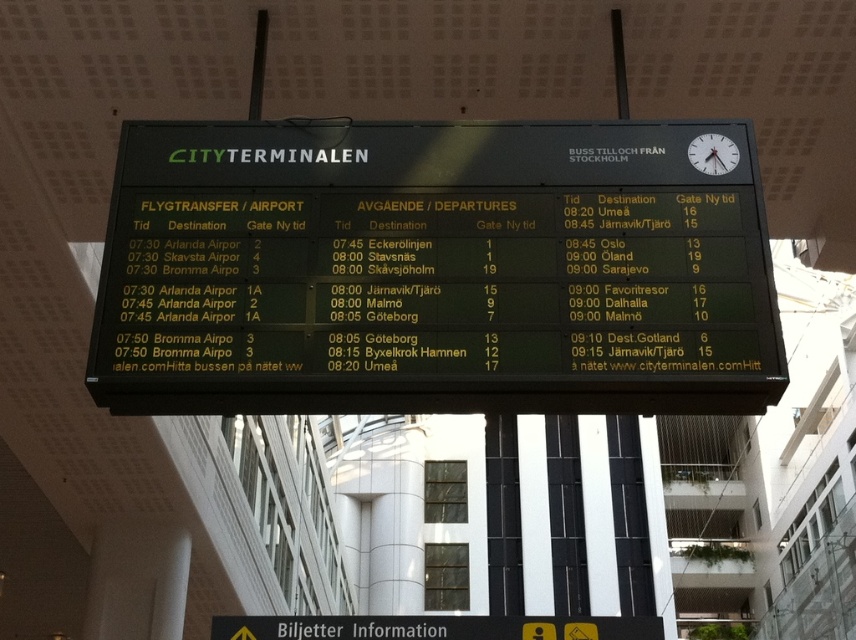
You are a traveler at Cityterminalen and need to check both the green plastic scoreboard at center and the white glossy clock at upper right. Which object is wider?

The green plastic scoreboard at center is wider than the white glossy clock at upper right.

You are a traveler at Cityterminalen looking at the digital departure board. You see two points marked on the board at coordinates point [330,154] and point [702,168]. Which point is closer to the front of the board?

Point [330,154] is behind point [702,168], so the point closer to the front of the board is point [702,168].

You are a maintenance worker needing to reach both the green plastic scoreboard at center and the white glossy clock at upper right with a 1.8 meter ladder. Can you safely access both objects with the ladder?

The distance between the green plastic scoreboard at center and the white glossy clock at upper right is 1.79 meters. Since the ladder is 1.8 meters long, it is just long enough to safely reach both objects.